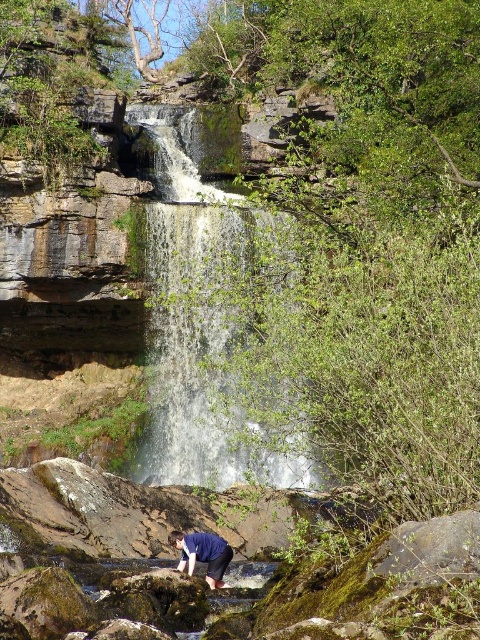
Who is lower down, white frothy water at center or blue fabric shirt at lower center?

Positioned lower is blue fabric shirt at lower center.

Is white frothy water at center below blue fabric shirt at lower center?

No.

Does point (193, 125) come farther from viewer compared to point (213, 540)?

Yes, it is behind point (213, 540).

Where is `white frothy water at center`? white frothy water at center is located at coordinates (200, 317).